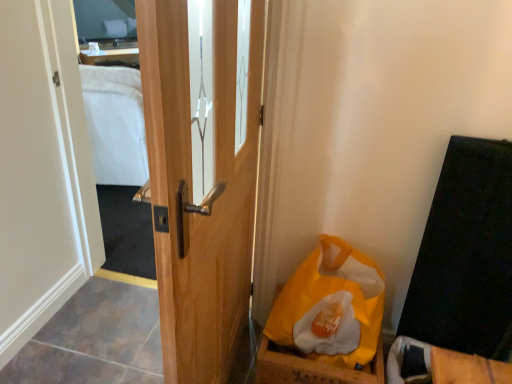
Question: Can you confirm if yellow paper bag at lower right is shorter than wooden door at center?

Choices:
 (A) no
 (B) yes

Answer: (B)

Question: Considering the relative sizes of yellow paper bag at lower right and wooden door at center in the image provided, is yellow paper bag at lower right thinner than wooden door at center?

Choices:
 (A) yes
 (B) no

Answer: (B)

Question: Is wooden door at center surrounded by yellow paper bag at lower right?

Choices:
 (A) no
 (B) yes

Answer: (A)

Question: From a real-world perspective, does yellow paper bag at lower right stand above wooden door at center?

Choices:
 (A) yes
 (B) no

Answer: (B)

Question: Can you confirm if yellow paper bag at lower right is bigger than wooden door at center?

Choices:
 (A) no
 (B) yes

Answer: (A)

Question: Considering the positions of point (139, 230) and point (226, 210), is point (139, 230) closer or farther from the camera than point (226, 210)?

Choices:
 (A) farther
 (B) closer

Answer: (A)

Question: Is clear glass mirror at upper left in front of or behind wooden door at center in the image?

Choices:
 (A) behind
 (B) front

Answer: (A)

Question: In terms of size, does clear glass mirror at upper left appear bigger or smaller than wooden door at center?

Choices:
 (A) big
 (B) small

Answer: (B)

Question: From a real-world perspective, is clear glass mirror at upper left positioned above or below wooden door at center?

Choices:
 (A) above
 (B) below

Answer: (B)

Question: Is wooden door at center inside the boundaries of clear glass mirror at upper left, or outside?

Choices:
 (A) inside
 (B) outside

Answer: (B)

Question: Considering their positions, is wooden door at center located in front of or behind clear glass mirror at upper left?

Choices:
 (A) front
 (B) behind

Answer: (A)

Question: In terms of size, does wooden door at center appear bigger or smaller than clear glass mirror at upper left?

Choices:
 (A) small
 (B) big

Answer: (B)

Question: From the image's perspective, is wooden door at center positioned above or below clear glass mirror at upper left?

Choices:
 (A) above
 (B) below

Answer: (B)

Question: From a real-world perspective, is clear glass mirror at upper left above or below yellow paper bag at lower right?

Choices:
 (A) below
 (B) above

Answer: (B)

Question: Looking at their shapes, would you say clear glass mirror at upper left is wider or thinner than yellow paper bag at lower right?

Choices:
 (A) wide
 (B) thin

Answer: (B)